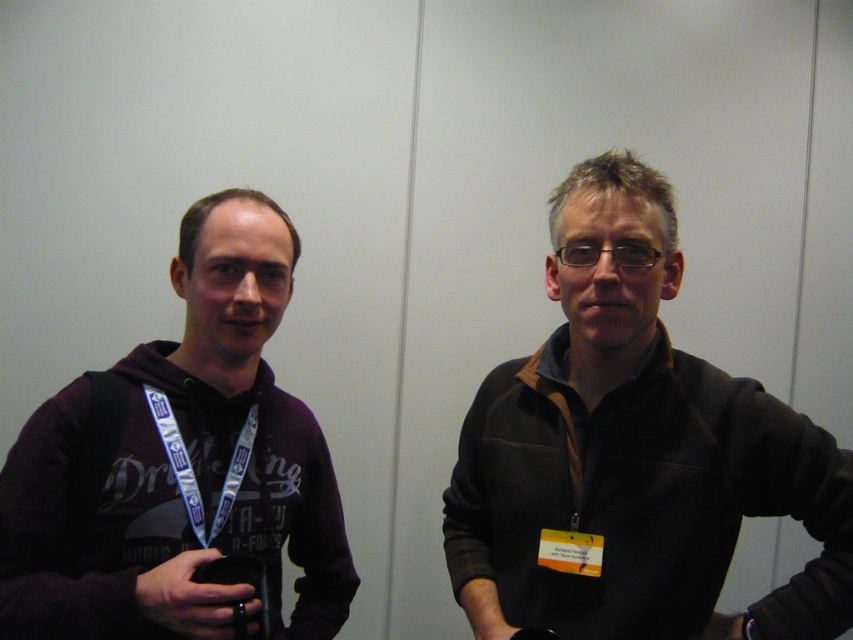
Is point (585, 332) less distant than point (344, 584)?

That is True.

Can you confirm if dark brown fleece at right is positioned below matte black hoodie at left?

Incorrect, dark brown fleece at right is not positioned below matte black hoodie at left.

Which is behind, point (815, 448) or point (276, 275)?

The point (276, 275) is behind.

This screenshot has width=853, height=640. Identify the location of dark brown fleece at right. (633, 454).